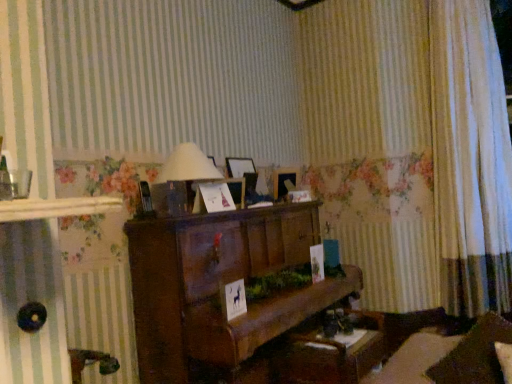
Question: Should I look upward or downward to see matte white lampshade at center?

Choices:
 (A) up
 (B) down

Answer: (A)

Question: Can you confirm if wooden table at lower center is bigger than matte white lampshade at center?

Choices:
 (A) no
 (B) yes

Answer: (B)

Question: Is wooden table at lower center to the left of matte white lampshade at center from the viewer's perspective?

Choices:
 (A) yes
 (B) no

Answer: (B)

Question: From the image's perspective, is wooden table at lower center on top of matte white lampshade at center?

Choices:
 (A) no
 (B) yes

Answer: (A)

Question: Does wooden table at lower center have a greater height compared to matte white lampshade at center?

Choices:
 (A) yes
 (B) no

Answer: (A)

Question: Is matte white lampshade at center a part of wooden table at lower center?

Choices:
 (A) yes
 (B) no

Answer: (B)

Question: Considering the relative sizes of wooden table at lower center and matte white lampshade at center in the image provided, is wooden table at lower center shorter than matte white lampshade at center?

Choices:
 (A) no
 (B) yes

Answer: (A)

Question: Considering the relative positions of matte white lampshade at center and white sheer curtain at right in the image provided, is matte white lampshade at center in front of white sheer curtain at right?

Choices:
 (A) yes
 (B) no

Answer: (A)

Question: Is matte white lampshade at center turned away from white sheer curtain at right?

Choices:
 (A) yes
 (B) no

Answer: (B)

Question: Is matte white lampshade at center far from white sheer curtain at right?

Choices:
 (A) yes
 (B) no

Answer: (A)

Question: From the image's perspective, is matte white lampshade at center over white sheer curtain at right?

Choices:
 (A) no
 (B) yes

Answer: (A)

Question: From a real-world perspective, is matte white lampshade at center positioned under white sheer curtain at right based on gravity?

Choices:
 (A) no
 (B) yes

Answer: (B)

Question: From the image's perspective, does matte white lampshade at center appear lower than white sheer curtain at right?

Choices:
 (A) yes
 (B) no

Answer: (A)

Question: Does wooden piano at center come behind white sheer curtain at right?

Choices:
 (A) no
 (B) yes

Answer: (A)